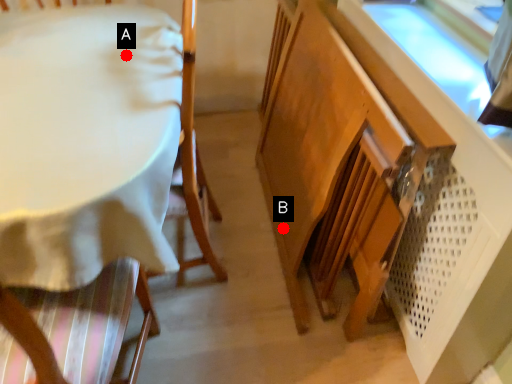
Question: Two points are circled on the image, labeled by A and B beside each circle. Which point is farther from the camera taking this photo?

Choices:
 (A) A is further
 (B) B is further

Answer: (B)